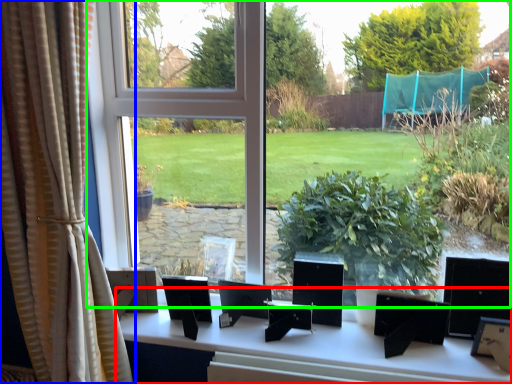
Question: Considering the real-world distances, which object is closest to table (highlighted by a red box)? curtain (highlighted by a blue box) or window (highlighted by a green box).

Choices:
 (A) curtain
 (B) window

Answer: (A)